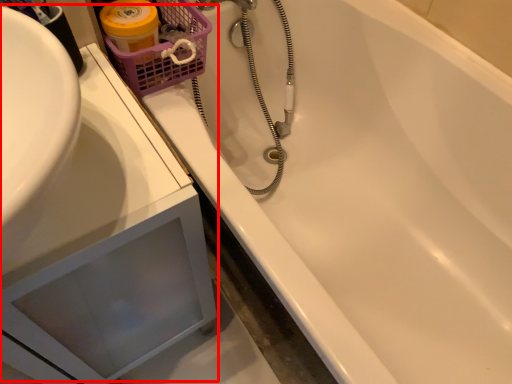
Question: Observing the image, what is the correct spatial positioning of sink (annotated by the red box) in reference to basket?

Choices:
 (A) right
 (B) left

Answer: (B)